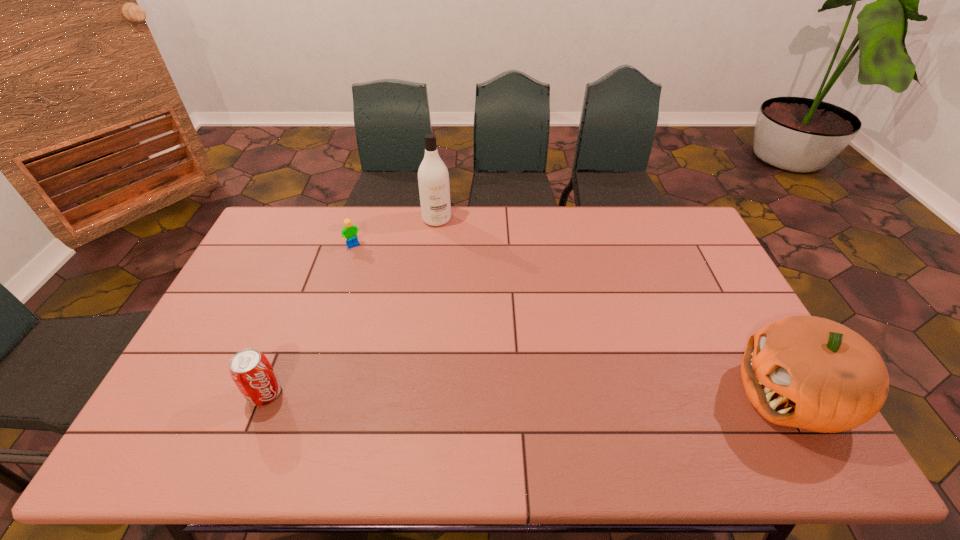
Choose which object is the nearest neighbor to the rightmost object. Please provide its 2D coordinates. Your answer should be formatted as a tuple, i.e. [(x, y)], where the tuple contains the x and y coordinates of a point satisfying the conditions above.

[(433, 179)]

The height and width of the screenshot is (540, 960). Find the location of `blank area in the image that satisfies the following two spatial constraints: 1. on the back side of the second object from right to left; 2. on the left side of the third tallest object`. blank area in the image that satisfies the following two spatial constraints: 1. on the back side of the second object from right to left; 2. on the left side of the third tallest object is located at coordinates (334, 219).

Find the location of a particular element. The height and width of the screenshot is (540, 960). vacant space that satisfies the following two spatial constraints: 1. on the front side of the second tallest object; 2. on the face of the shampoo is located at coordinates (417, 395).

This screenshot has width=960, height=540. Identify the location of vacant area that satisfies the following two spatial constraints: 1. on the back side of the leftmost object; 2. on the left side of the third object from right to left. (324, 246).

The image size is (960, 540). I want to click on free space that satisfies the following two spatial constraints: 1. on the back side of the soda; 2. on the left side of the shampoo, so click(x=334, y=219).

Where is `vacant area in the image that satisfies the following two spatial constraints: 1. on the front side of the rightmost object; 2. on the face of the second object from left to right`? vacant area in the image that satisfies the following two spatial constraints: 1. on the front side of the rightmost object; 2. on the face of the second object from left to right is located at coordinates (308, 395).